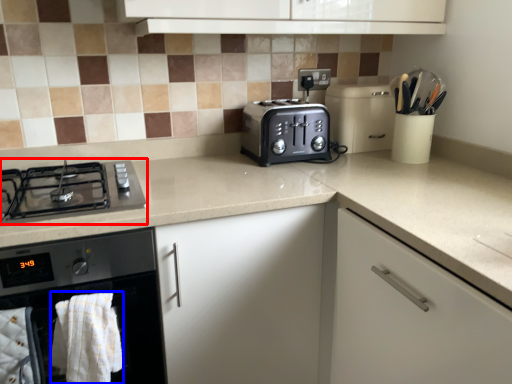
Question: Which point is closer to the camera, gas stove (highlighted by a red box) or bath towel (highlighted by a blue box)?

Choices:
 (A) gas stove
 (B) bath towel

Answer: (B)